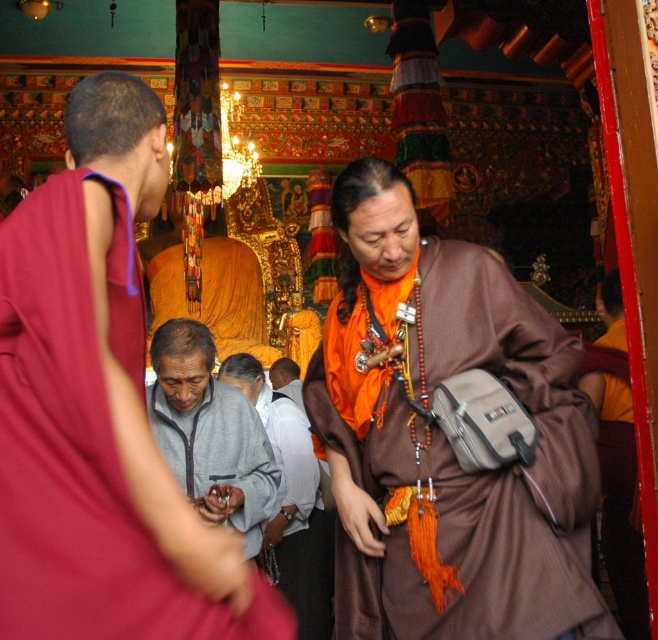
Question: In this image, where is matte red robe at center located relative to orange fabric at center?

Choices:
 (A) above
 (B) below

Answer: (A)

Question: In this image, where is orange fabric at center located relative to brown fabric bag at center?

Choices:
 (A) above
 (B) below

Answer: (B)

Question: Does brown matte robe at center appear under matte red robe at center?

Choices:
 (A) no
 (B) yes

Answer: (A)

Question: Which of the following is the farthest from the observer?

Choices:
 (A) orange fabric at center
 (B) brown fabric bag at center
 (C) matte red robe at center
 (D) brown matte robe at center

Answer: (A)

Question: Which object appears farthest from the camera in this image?

Choices:
 (A) brown fabric bag at center
 (B) gray fleece jacket at center
 (C) brown matte robe at center

Answer: (B)

Question: Which point is closer to the camera?

Choices:
 (A) matte red robe at center
 (B) orange fabric at center
 (C) brown matte robe at center
 (D) gray fleece jacket at center

Answer: (A)